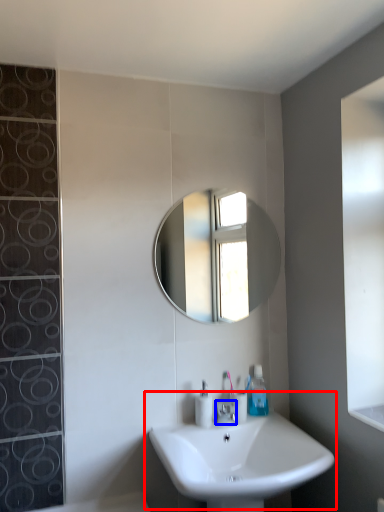
Question: Which object is further to the camera taking this photo, sink (highlighted by a red box) or tap (highlighted by a blue box)?

Choices:
 (A) sink
 (B) tap

Answer: (B)